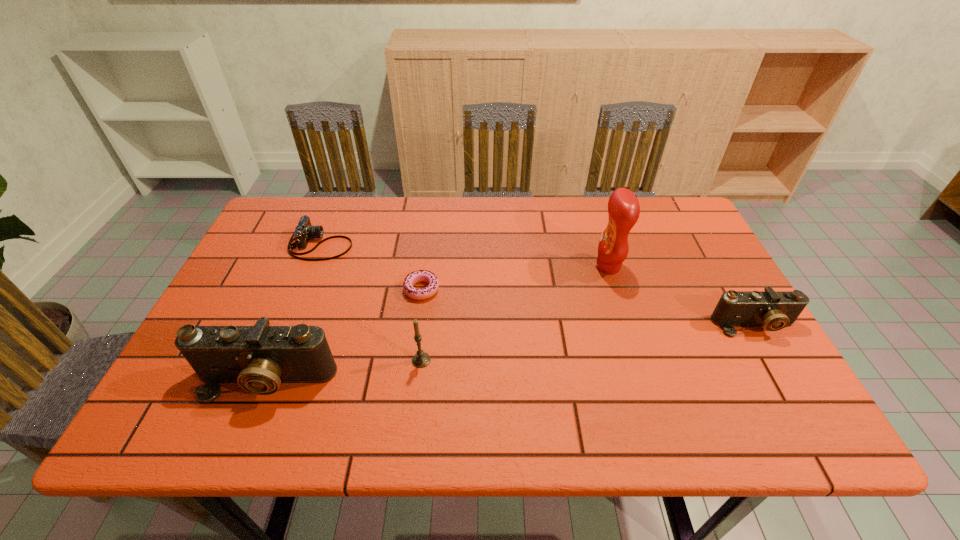
To achieve even spacing by inserting another camera among them, please point to a vacant spot for this new camera. Please provide its 2D coordinates. Your answer should be formatted as a tuple, i.e. [(x, y)], where the tuple contains the x and y coordinates of a point satisfying the conditions above.

[(523, 351)]